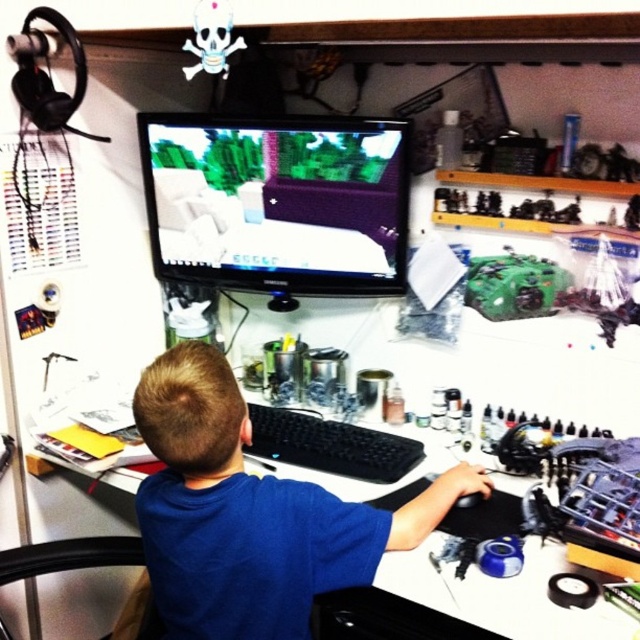
Question: Which object is farther from the camera taking this photo?

Choices:
 (A) matte black monitor at center
 (B) black rubberized keyboard at center
 (C) green plastic toy at center-right
 (D) black leather swivel chair at lower left

Answer: (A)

Question: Does matte black monitor at center have a lesser width compared to black rubberized keyboard at center?

Choices:
 (A) yes
 (B) no

Answer: (B)

Question: Among these objects, which one is nearest to the camera?

Choices:
 (A) matte black monitor at center
 (B) black rubberized keyboard at center
 (C) green plastic toy at center-right

Answer: (B)

Question: Which object is closer to the camera taking this photo?

Choices:
 (A) green plastic toy at center-right
 (B) blue matte shirt at center
 (C) black leather swivel chair at lower left
 (D) black rubberized keyboard at center

Answer: (B)

Question: Does matte black monitor at center appear on the left side of black rubberized keyboard at center?

Choices:
 (A) no
 (B) yes

Answer: (B)

Question: Can you confirm if black rubberized keyboard at center is thinner than black leather swivel chair at lower left?

Choices:
 (A) yes
 (B) no

Answer: (B)